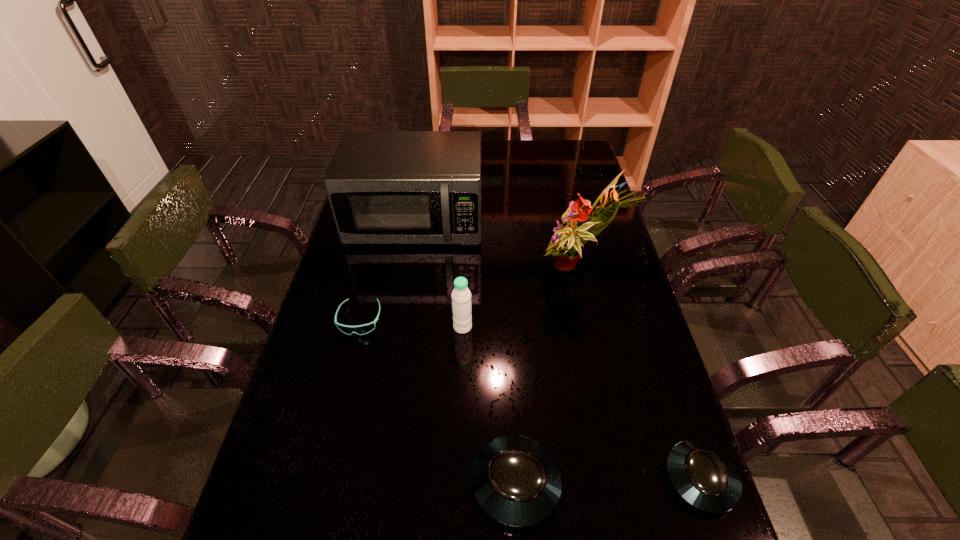
Where is `vacant space situated on the front-facing side of the microwave oven`? This screenshot has width=960, height=540. vacant space situated on the front-facing side of the microwave oven is located at coordinates (397, 334).

Locate an element on the screen. Image resolution: width=960 pixels, height=540 pixels. free location located 0.160m on the front-facing side of the shortest object is located at coordinates (342, 390).

The image size is (960, 540). Find the location of `free space located 0.300m on the front-facing side of the tallest object`. free space located 0.300m on the front-facing side of the tallest object is located at coordinates (438, 271).

I want to click on free space located 0.240m on the front-facing side of the tallest object, so click(457, 271).

Identify the location of vacant space located on the front-facing side of the tallest object. The image size is (960, 540). (467, 271).

Locate an element on the screen. This screenshot has width=960, height=540. free space located on the right of the water bottle is located at coordinates (551, 327).

Identify the location of microwave oven present at the left edge. The width and height of the screenshot is (960, 540). (384, 187).

Image resolution: width=960 pixels, height=540 pixels. I want to click on sunglasses that is at the left edge, so click(366, 328).

Locate an element on the screen. This screenshot has width=960, height=540. saucer situated at the right edge is located at coordinates click(x=701, y=474).

In order to click on bouquet that is at the right edge in this screenshot , I will do `click(565, 246)`.